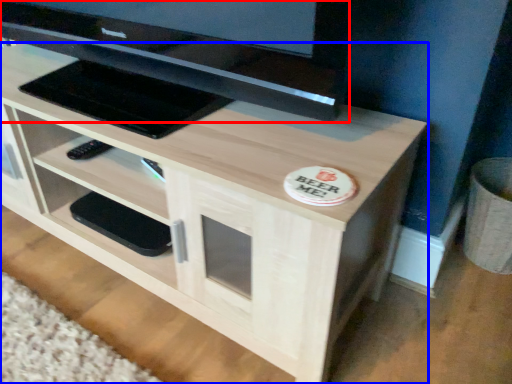
Question: Which point is closer to the camera, television (highlighted by a red box) or desk (highlighted by a blue box)?

Choices:
 (A) television
 (B) desk

Answer: (A)